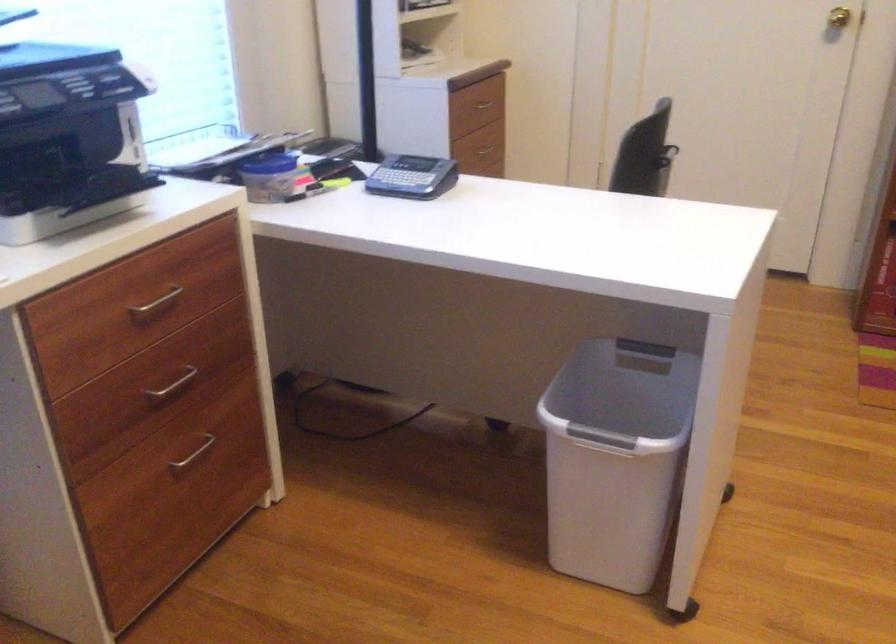
Image resolution: width=896 pixels, height=644 pixels. What do you see at coordinates (685, 611) in the screenshot?
I see `the black caster wheel` at bounding box center [685, 611].